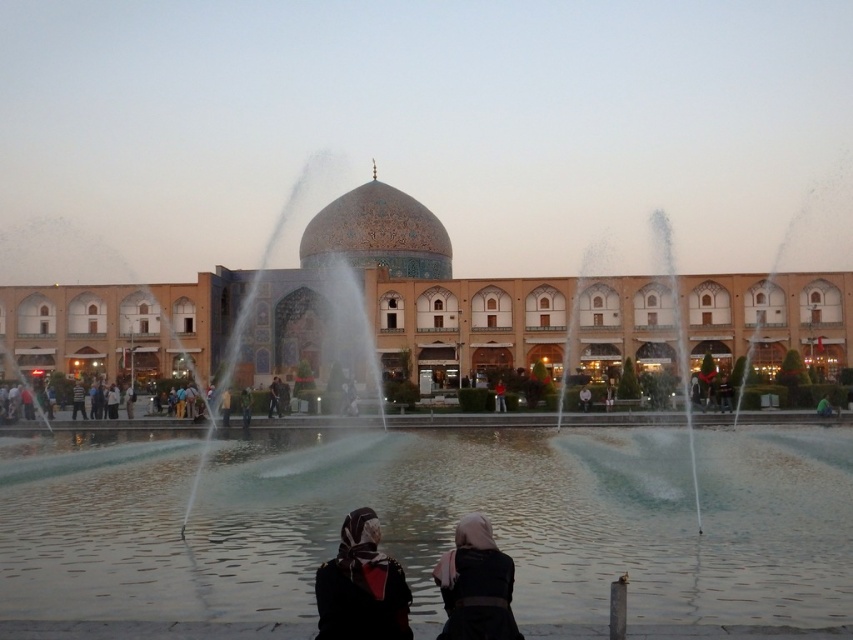
Is matte black hijab at lower center shorter than dark fabric headscarf at center?

No, matte black hijab at lower center is not shorter than dark fabric headscarf at center.

Is matte black hijab at lower center above dark fabric headscarf at center?

No, matte black hijab at lower center is not above dark fabric headscarf at center.

Does point (363, 628) come farther from viewer compared to point (486, 532)?

No, (363, 628) is closer to viewer.

Identify the location of matte black hijab at lower center. (361, 586).

What do you see at coordinates (361, 586) in the screenshot? The image size is (853, 640). I see `matte black hijab at lower center` at bounding box center [361, 586].

The height and width of the screenshot is (640, 853). In order to click on matte black hijab at lower center in this screenshot , I will do `click(361, 586)`.

What do you see at coordinates (474, 584) in the screenshot? I see `dark fabric headscarf at center` at bounding box center [474, 584].

Between point (462, 541) and point (497, 406), which one is positioned in front?

Point (462, 541)

Where is `dark fabric headscarf at center`? dark fabric headscarf at center is located at coordinates (474, 584).